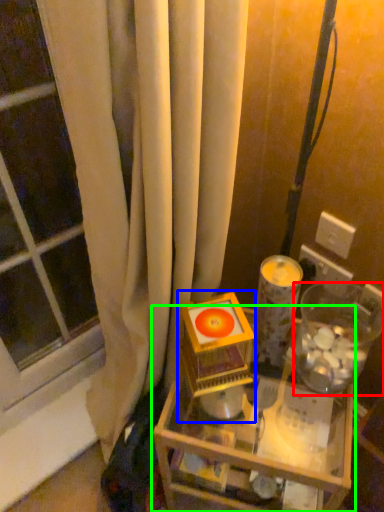
Question: Which object is positioned closest to glass jar (highlighted by a red box)? Select from toy (highlighted by a blue box) and table (highlighted by a green box).

Choices:
 (A) toy
 (B) table

Answer: (A)